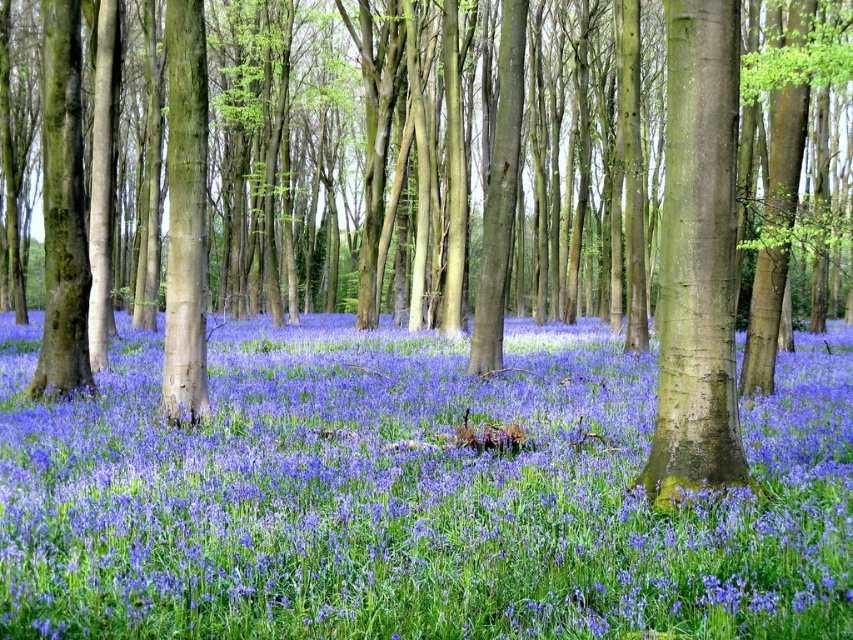
You are a hiker who wants to place a 10 meter long rope between the purple matte flower at center and the smooth brown tree trunk at center. Is the rope long enough to reach between them?

The distance between the purple matte flower at center and the smooth brown tree trunk at center is 9.14 meters, so the 10 meter long rope is long enough to reach between them.

You are a botanist examining the forest floor and notice the purple matte flower at center and the smooth brown tree trunk at center. From your perspective, which object is located to the right?

The smooth brown tree trunk at center is located to the right of the purple matte flower at center.